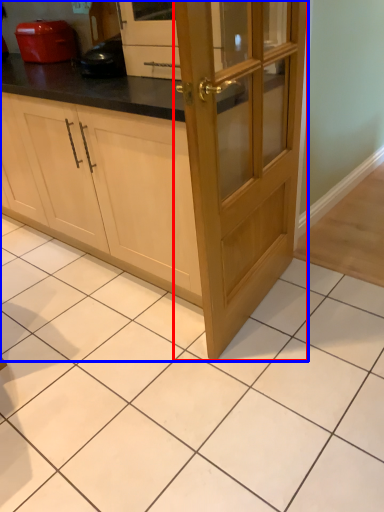
Question: Which object appears farthest to the camera in this image, door (highlighted by a red box) or cabinetry (highlighted by a blue box)?

Choices:
 (A) door
 (B) cabinetry

Answer: (B)